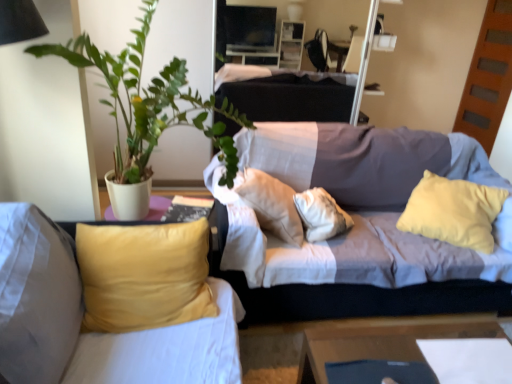
Where is `free space above wooden table at lower right (from a real-world perspective)`? The width and height of the screenshot is (512, 384). free space above wooden table at lower right (from a real-world perspective) is located at coordinates (418, 352).